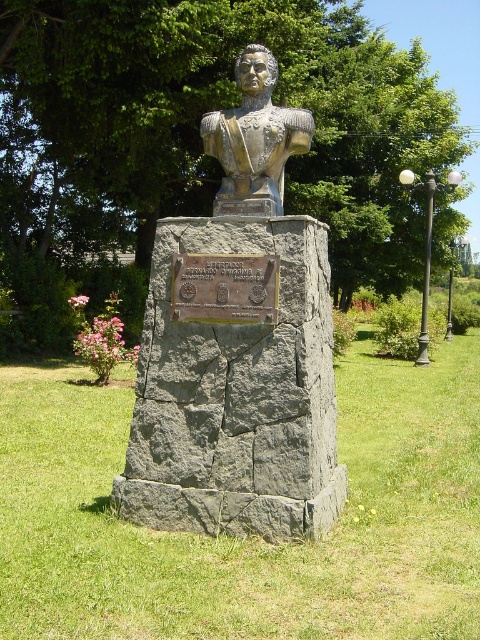
You are a tour guide leading a group through a park. You want to point out the shiny bronze bust at center and the bronze plaque at center to your group. How far apart are these two items?

The shiny bronze bust at center is 20.99 inches away from the bronze plaque at center.